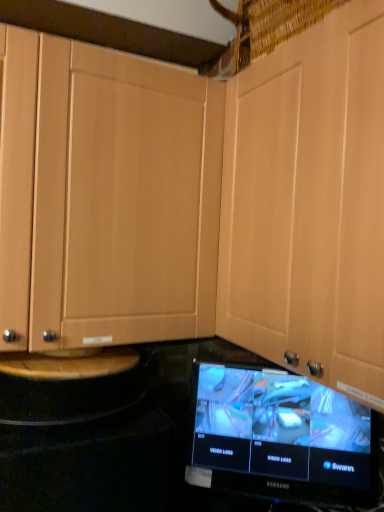
Question: Is point (355, 449) closer or farther from the camera than point (327, 201)?

Choices:
 (A) farther
 (B) closer

Answer: (A)

Question: Relative to matte wood cabinet at center, is black glossy monitor at lower center in front or behind?

Choices:
 (A) front
 (B) behind

Answer: (B)

Question: Is black glossy monitor at lower center inside or outside of matte wood cabinet at center?

Choices:
 (A) outside
 (B) inside

Answer: (A)

Question: Visually, is matte wood cabinet at center positioned to the left or to the right of black glossy monitor at lower center?

Choices:
 (A) left
 (B) right

Answer: (B)

Question: Is matte wood cabinet at center wider or thinner than black glossy monitor at lower center?

Choices:
 (A) wide
 (B) thin

Answer: (A)

Question: From the image's perspective, is matte wood cabinet at center located above or below black glossy monitor at lower center?

Choices:
 (A) below
 (B) above

Answer: (B)

Question: In terms of height, does matte wood cabinet at center look taller or shorter compared to black glossy monitor at lower center?

Choices:
 (A) short
 (B) tall

Answer: (B)